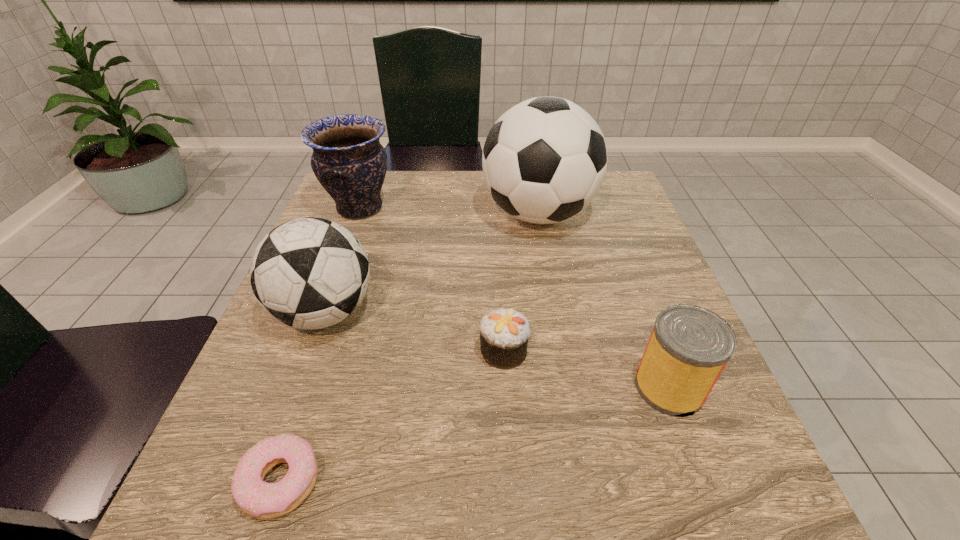
The image size is (960, 540). I want to click on free space at the far left corner of the desktop, so pos(395,176).

In the image, there is a desktop. Identify the location of blank space at the near left corner. This screenshot has height=540, width=960. (275, 482).

This screenshot has height=540, width=960. Identify the location of empty space between the can and the cupcake. (587, 369).

Locate an element on the screen. Image resolution: width=960 pixels, height=540 pixels. blank region between the can and the doughnut is located at coordinates (475, 434).

Locate an element on the screen. This screenshot has width=960, height=540. vacant space that's between the fourth tallest object and the fifth tallest object is located at coordinates (587, 369).

Find the location of `free space that is in between the tallest object and the third shortest object`. free space that is in between the tallest object and the third shortest object is located at coordinates (604, 300).

Locate an element on the screen. empty space that is in between the pottery and the fourth tallest object is located at coordinates (515, 298).

The image size is (960, 540). What are the coordinates of `free area in between the pottery and the cupcake` in the screenshot? It's located at (431, 280).

At what (x,y) coordinates should I click in order to perform the action: click on unoccupied area between the pottery and the farther soccer ball. Please return your answer as a coordinate pair (x, y). This screenshot has height=540, width=960. Looking at the image, I should click on (449, 211).

The image size is (960, 540). Find the location of `vacant area that lies between the pottery and the fourth tallest object`. vacant area that lies between the pottery and the fourth tallest object is located at coordinates (515, 298).